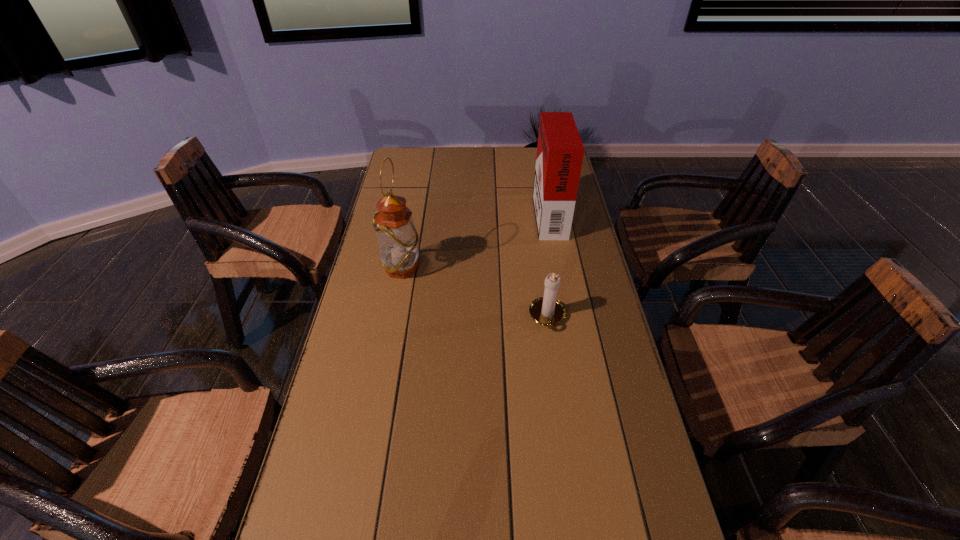
This screenshot has height=540, width=960. I want to click on object that is at the left edge, so click(x=397, y=238).

At what (x,y) coordinates should I click in order to perform the action: click on cigarette case that is at the right edge. Please return your answer as a coordinate pair (x, y). This screenshot has width=960, height=540. Looking at the image, I should click on point(560,151).

Where is `candle holder that is at the right edge`? This screenshot has width=960, height=540. candle holder that is at the right edge is located at coordinates (548, 311).

In the image, there is a desktop. At what (x,y) coordinates should I click in order to perform the action: click on vacant space at the far edge. Please return your answer as a coordinate pair (x, y). The width and height of the screenshot is (960, 540). Looking at the image, I should click on (521, 156).

The width and height of the screenshot is (960, 540). In the image, there is a desktop. What are the coordinates of `vacant space at the left edge` in the screenshot? It's located at click(354, 368).

Image resolution: width=960 pixels, height=540 pixels. In the image, there is a desktop. In order to click on vacant region at the right edge in this screenshot , I will do `click(585, 217)`.

You are a GUI agent. You are given a task and a screenshot of the screen. Output one action in this format:
    pyautogui.click(x=<x>, y=<y>)
    Task: Click on the vacant space at the far left corner of the desktop
    The height and width of the screenshot is (540, 960).
    Given the screenshot: What is the action you would take?
    (x=402, y=150)

Find the location of a particular element. vacant space at the far right corner is located at coordinates (532, 161).

Where is `free space between the leftmost object and the shortest object`? free space between the leftmost object and the shortest object is located at coordinates (475, 293).

What are the coordinates of `free area in between the oil lamp and the candle holder` in the screenshot? It's located at (475, 293).